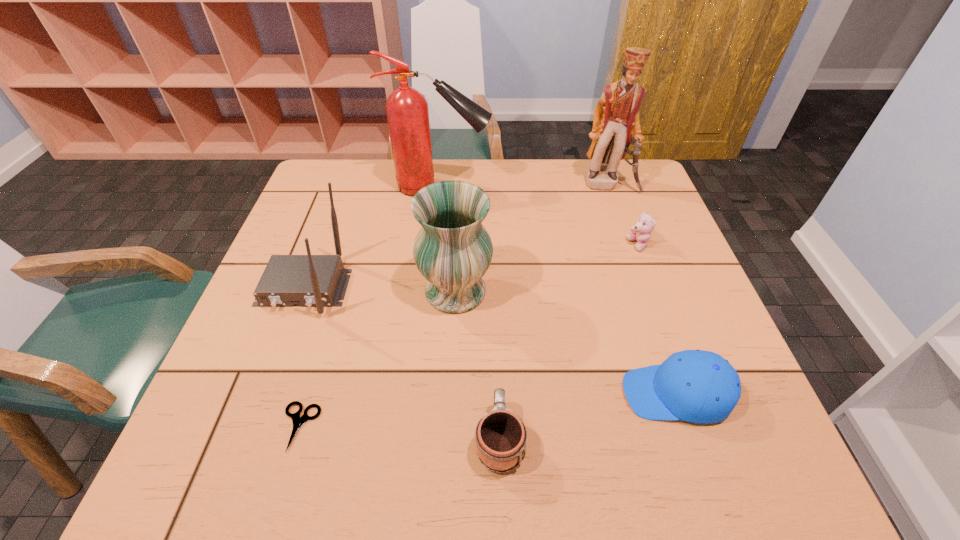
Where is `vacant region located on the side of the mug with the handle`? This screenshot has height=540, width=960. vacant region located on the side of the mug with the handle is located at coordinates (497, 381).

This screenshot has height=540, width=960. I want to click on vacant region located on the left of the shortest object, so click(221, 427).

This screenshot has width=960, height=540. I want to click on nutcracker situated at the far edge, so click(616, 123).

What are the coordinates of `fire extinguisher present at the far edge` in the screenshot? It's located at (407, 112).

This screenshot has height=540, width=960. Identify the location of mug at the near edge. (500, 437).

You are a GUI agent. You are given a task and a screenshot of the screen. Output one action in this format:
    pyautogui.click(x=<x>, y=<y>)
    Task: Click on the shears that is at the near edge
    This screenshot has width=960, height=540.
    Given the screenshot: What is the action you would take?
    pyautogui.click(x=298, y=421)

Where is `router that is at the left edge`? router that is at the left edge is located at coordinates (309, 280).

Locate an element on the screen. Image resolution: width=960 pixels, height=540 pixels. shears present at the left edge is located at coordinates [x=298, y=421].

At what (x,y) coordinates should I click in order to perform the action: click on nutcracker that is at the right edge. Please return your answer as a coordinate pair (x, y). Looking at the image, I should click on (616, 123).

At what (x,y) coordinates should I click in order to perform the action: click on cap situated at the right edge. Please return your answer as a coordinate pair (x, y). Image resolution: width=960 pixels, height=540 pixels. Looking at the image, I should click on (697, 386).